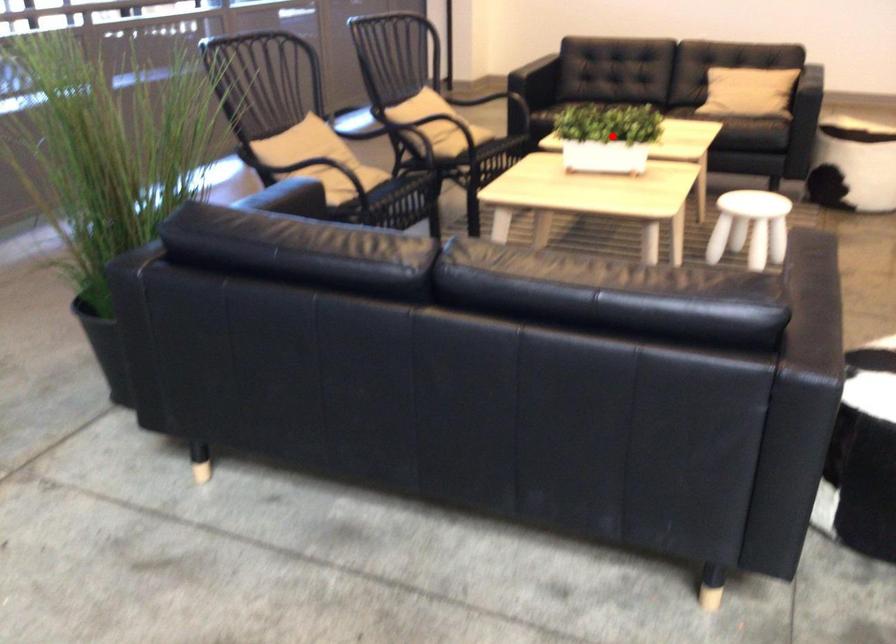
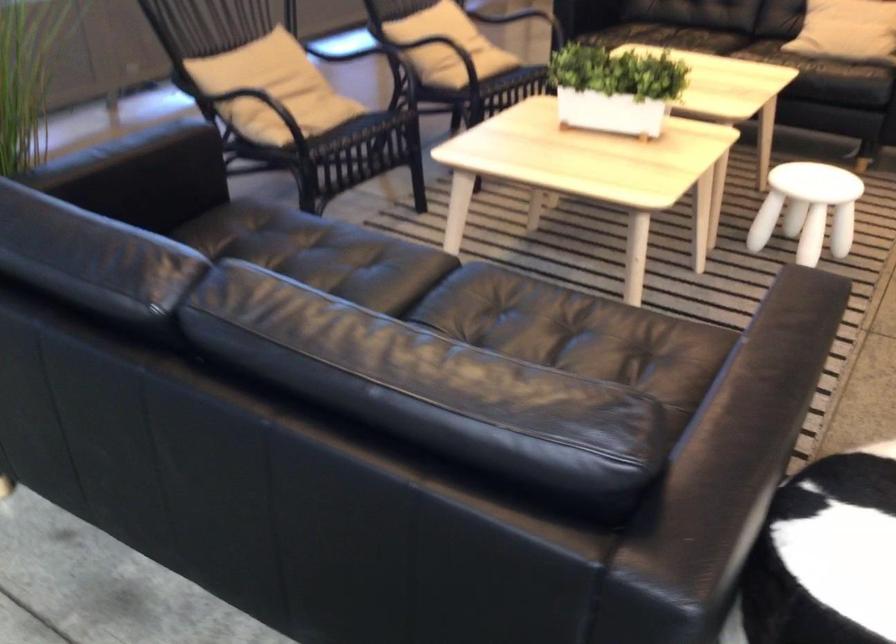
Question: A red point is marked in image1. In image2, is the corresponding 3D point closer to the camera or farther? Reply with the corresponding letter.

Choices:
 (A) The corresponding 3D point is closer.
 (B) The corresponding 3D point is farther.

Answer: (A)